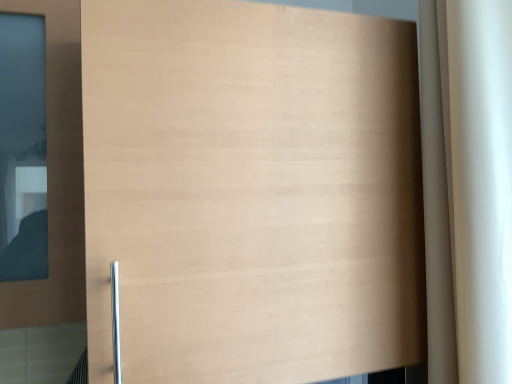
Image resolution: width=512 pixels, height=384 pixels. I want to click on wooden door at center, so click(x=251, y=192).

Describe the element at coordinates (251, 192) in the screenshot. I see `wooden door at center` at that location.

What are the coordinates of `wooden door at center` in the screenshot? It's located at (251, 192).